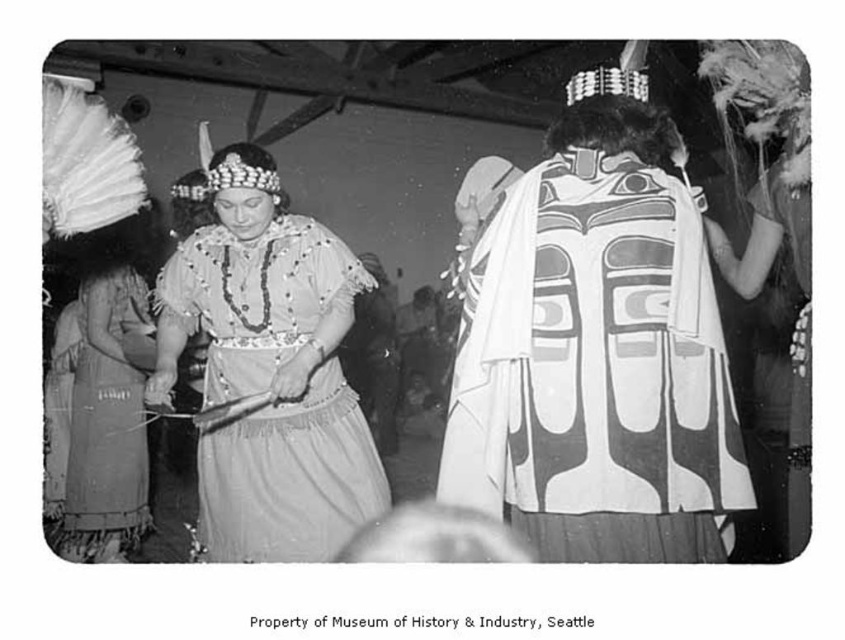
From the picture: Which is more to the left, white painted wood totem at center or matte fabric dress at center?

From the viewer's perspective, matte fabric dress at center appears more on the left side.

Looking at this image, can you confirm if white painted wood totem at center is shorter than matte fabric dress at center?

Indeed, white painted wood totem at center has a lesser height compared to matte fabric dress at center.

The height and width of the screenshot is (640, 845). What do you see at coordinates (595, 369) in the screenshot?
I see `white painted wood totem at center` at bounding box center [595, 369].

Identify the location of white painted wood totem at center. (595, 369).

Does matte fabric dress at center appear on the left side of textured gray dress at left?

Incorrect, matte fabric dress at center is not on the left side of textured gray dress at left.

Who is taller, matte fabric dress at center or textured gray dress at left?

Standing taller between the two is matte fabric dress at center.

This screenshot has width=845, height=640. I want to click on matte fabric dress at center, so click(270, 371).

Identify the location of matte fabric dress at center. The height and width of the screenshot is (640, 845). (270, 371).

Does point (620, 516) come closer to viewer compared to point (112, 468)?

Yes, point (620, 516) is closer to viewer.

Between point (533, 269) and point (131, 371), which one is positioned in front?

Point (533, 269)

Where is `white painted wood totem at center`? This screenshot has height=640, width=845. white painted wood totem at center is located at coordinates (595, 369).